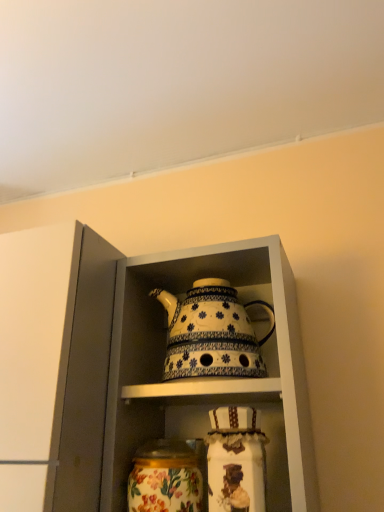
Question: Looking at their shapes, would you say white glossy teapot at center is wider or thinner than floral painted glass jar at lower center?

Choices:
 (A) wide
 (B) thin

Answer: (A)

Question: From the image's perspective, is white glossy teapot at center located above or below floral painted glass jar at lower center?

Choices:
 (A) above
 (B) below

Answer: (A)

Question: Estimate the real-world distances between objects in this image. Which object is closer to the floral painted glass jar at lower center?

Choices:
 (A) white ceramic teapot at center
 (B) white glossy teapot at center

Answer: (A)

Question: Which object is the closest to the white ceramic teapot at center?

Choices:
 (A) floral painted glass jar at lower center
 (B) white glossy teapot at center

Answer: (B)